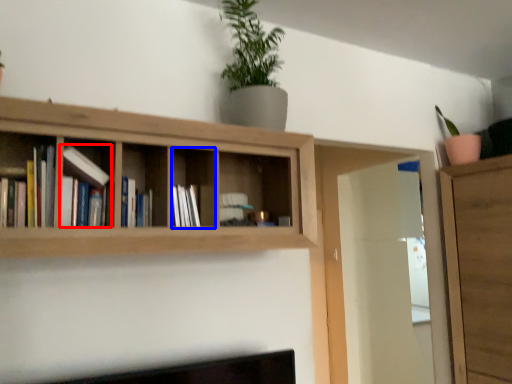
Question: Which of the following is the farthest to the observer, book (highlighted by a red box) or cabinet (highlighted by a blue box)?

Choices:
 (A) book
 (B) cabinet

Answer: (B)